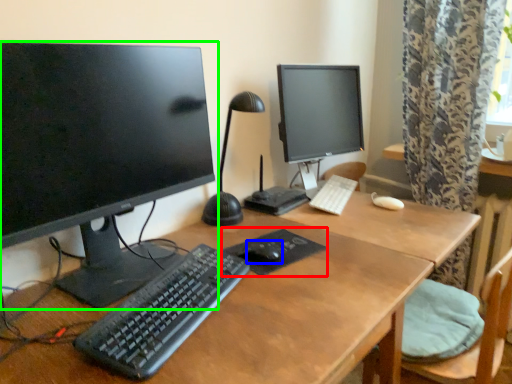
Question: Considering the real-world distances, which object is closest to mousepad (highlighted by a red box)? mouse (highlighted by a blue box) or computer monitor (highlighted by a green box).

Choices:
 (A) mouse
 (B) computer monitor

Answer: (A)